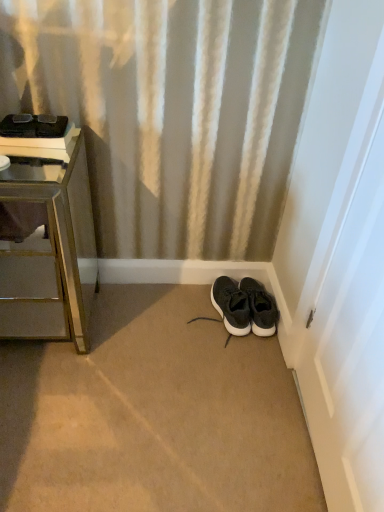
Question: Is brushed metal nightstand at left beside black fabric sneakers at center, the first footwear viewed from the left?

Choices:
 (A) yes
 (B) no

Answer: (B)

Question: Is brushed metal nightstand at left completely or partially outside of black fabric sneakers at center, acting as the 2th footwear starting from the right?

Choices:
 (A) yes
 (B) no

Answer: (A)

Question: Is the depth of brushed metal nightstand at left less than that of black fabric sneakers at center, the first footwear viewed from the left?

Choices:
 (A) yes
 (B) no

Answer: (A)

Question: Is the depth of brushed metal nightstand at left greater than that of black fabric sneakers at center, acting as the 2th footwear starting from the right?

Choices:
 (A) yes
 (B) no

Answer: (B)

Question: Considering the relative sizes of brushed metal nightstand at left and black fabric sneakers at center, acting as the 2th footwear starting from the right, in the image provided, is brushed metal nightstand at left thinner than black fabric sneakers at center, acting as the 2th footwear starting from the right,?

Choices:
 (A) yes
 (B) no

Answer: (B)

Question: Looking at their shapes, would you say black fabric sneakers at center, acting as the 2th footwear starting from the right, is wider or thinner than white glossy door at right?

Choices:
 (A) wide
 (B) thin

Answer: (A)

Question: Based on their positions, is black fabric sneakers at center, acting as the 2th footwear starting from the right, located to the left or right of white glossy door at right?

Choices:
 (A) left
 (B) right

Answer: (A)

Question: From the image's perspective, is black fabric sneakers at center, the first footwear viewed from the left, above or below white glossy door at right?

Choices:
 (A) above
 (B) below

Answer: (B)

Question: Considering their positions, is black fabric sneakers at center, the first footwear viewed from the left, located in front of or behind white glossy door at right?

Choices:
 (A) behind
 (B) front

Answer: (A)

Question: Is black fabric sneakers at center, acting as the 2th footwear starting from the right, bigger or smaller than brushed metal nightstand at left?

Choices:
 (A) small
 (B) big

Answer: (A)

Question: Is black fabric sneakers at center, acting as the 2th footwear starting from the right, inside or outside of brushed metal nightstand at left?

Choices:
 (A) outside
 (B) inside

Answer: (A)

Question: From a real-world perspective, relative to brushed metal nightstand at left, is black fabric sneakers at center, acting as the 2th footwear starting from the right, vertically above or below?

Choices:
 (A) above
 (B) below

Answer: (B)

Question: Visually, is black fabric sneakers at center, the first footwear viewed from the left, positioned to the left or to the right of brushed metal nightstand at left?

Choices:
 (A) right
 (B) left

Answer: (A)

Question: In terms of width, does black suede sneakers at lower right, the second footwear when ordered from left to right, look wider or thinner when compared to brushed metal nightstand at left?

Choices:
 (A) thin
 (B) wide

Answer: (A)

Question: Considering their positions, is black suede sneakers at lower right, which is counted as the 1th footwear, starting from the right, located in front of or behind brushed metal nightstand at left?

Choices:
 (A) behind
 (B) front

Answer: (A)